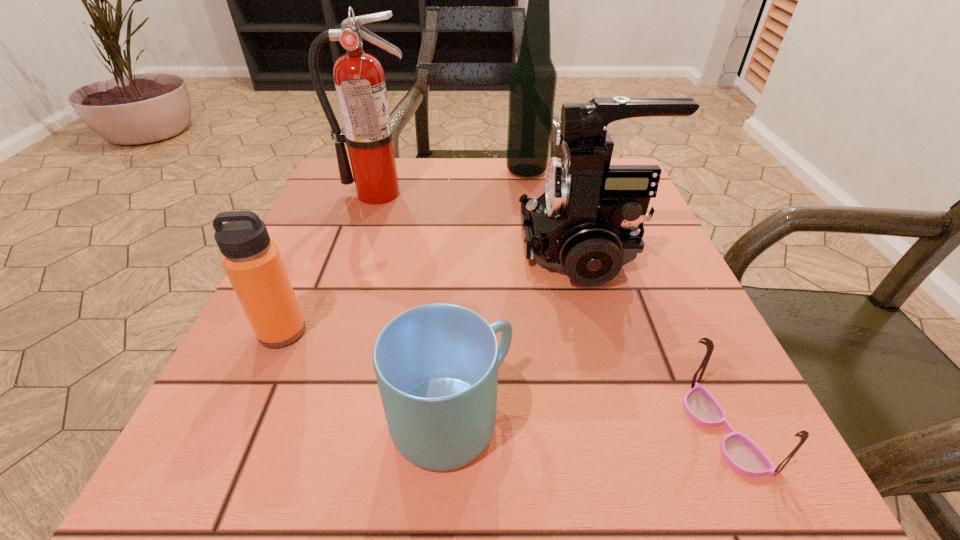
Find the location of a particular element. The image size is (960, 540). free spot located 0.340m on the nozzle side of the fire extinguisher is located at coordinates (335, 318).

Where is `blank space located on the lens mount of the third farthest object`? The height and width of the screenshot is (540, 960). blank space located on the lens mount of the third farthest object is located at coordinates (364, 252).

Where is `free region located 0.230m on the lens mount of the third farthest object`? The image size is (960, 540). free region located 0.230m on the lens mount of the third farthest object is located at coordinates (400, 252).

The image size is (960, 540). In order to click on free space located on the lens mount of the third farthest object in this screenshot , I will do `click(316, 252)`.

What are the coordinates of `free space located on the back of the third nearest object` in the screenshot? It's located at (340, 204).

At what (x,y) coordinates should I click in order to perform the action: click on vacant space located on the right of the second shortest object. Please return your answer as a coordinate pair (x, y). The width and height of the screenshot is (960, 540). Looking at the image, I should click on point(705,420).

Find the location of `blank space located 0.150m on the back of the shortest object`. blank space located 0.150m on the back of the shortest object is located at coordinates (668, 308).

You are a GUI agent. You are given a task and a screenshot of the screen. Output one action in this format:
    pyautogui.click(x=<x>, y=<y>)
    Task: Click on the alcohol located in the far edge section of the desktop
    
    Given the screenshot: What is the action you would take?
    pyautogui.click(x=533, y=78)

Find the location of `fire extinguisher that is positioned at the far edge`. fire extinguisher that is positioned at the far edge is located at coordinates (359, 78).

At what (x,y) coordinates should I click in order to perform the action: click on mug present at the near edge. Please return your answer as a coordinate pair (x, y). Looking at the image, I should click on (436, 365).